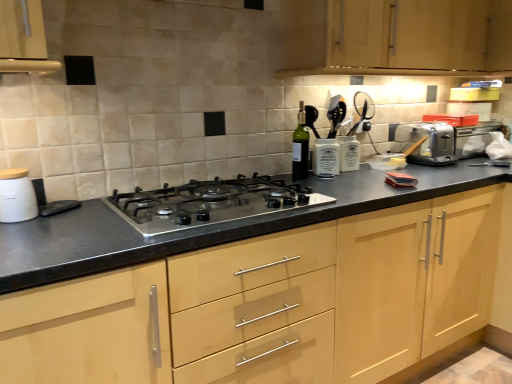
This screenshot has width=512, height=384. I want to click on vacant space in front of white matte canister at left, so click(19, 233).